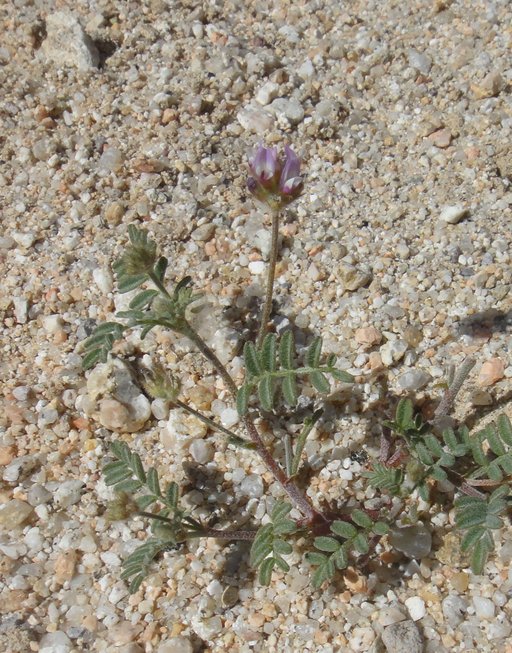
In order to click on plant in this screenshot , I will do `click(268, 163)`, `click(270, 277)`, `click(288, 387)`, `click(303, 370)`, `click(275, 206)`, `click(202, 531)`, `click(139, 470)`, `click(177, 322)`.